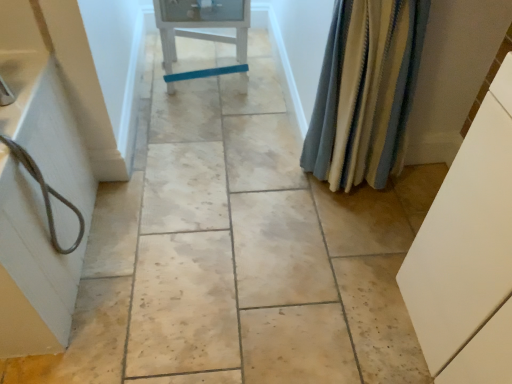
Question: Can you confirm if white matte cabinet at right is taller than striped fabric shower curtain at right?

Choices:
 (A) no
 (B) yes

Answer: (B)

Question: Is white matte cabinet at right thinner than striped fabric shower curtain at right?

Choices:
 (A) no
 (B) yes

Answer: (A)

Question: Considering the relative positions of white matte cabinet at right and striped fabric shower curtain at right in the image provided, is white matte cabinet at right to the right of striped fabric shower curtain at right from the viewer's perspective?

Choices:
 (A) yes
 (B) no

Answer: (A)

Question: Is white matte cabinet at right positioned before striped fabric shower curtain at right?

Choices:
 (A) yes
 (B) no

Answer: (A)

Question: From the image's perspective, is white matte cabinet at right above striped fabric shower curtain at right?

Choices:
 (A) no
 (B) yes

Answer: (A)

Question: Does white matte cabinet at right come behind striped fabric shower curtain at right?

Choices:
 (A) yes
 (B) no

Answer: (B)

Question: Considering the relative sizes of matte gray cord at left and striped fabric shower curtain at right in the image provided, is matte gray cord at left smaller than striped fabric shower curtain at right?

Choices:
 (A) yes
 (B) no

Answer: (B)

Question: Is the surface of matte gray cord at left in direct contact with striped fabric shower curtain at right?

Choices:
 (A) yes
 (B) no

Answer: (B)

Question: Can you confirm if matte gray cord at left is positioned to the right of striped fabric shower curtain at right?

Choices:
 (A) yes
 (B) no

Answer: (B)

Question: From a real-world perspective, is matte gray cord at left located beneath striped fabric shower curtain at right?

Choices:
 (A) yes
 (B) no

Answer: (B)

Question: Could you tell me if matte gray cord at left is turned towards striped fabric shower curtain at right?

Choices:
 (A) yes
 (B) no

Answer: (B)

Question: Can you confirm if matte gray cord at left is thinner than striped fabric shower curtain at right?

Choices:
 (A) yes
 (B) no

Answer: (B)

Question: Considering the relative sizes of white painted wood chair at center and striped fabric shower curtain at right in the image provided, is white painted wood chair at center wider than striped fabric shower curtain at right?

Choices:
 (A) no
 (B) yes

Answer: (B)